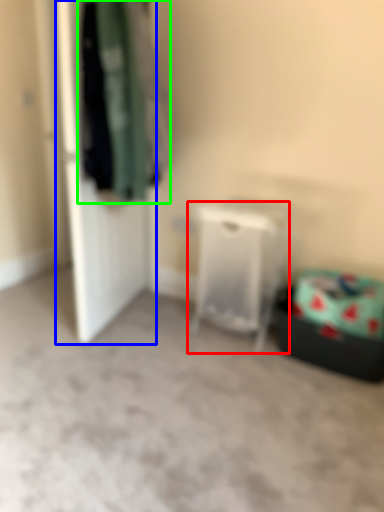
Question: Based on their relative distances, which object is farther from furniture (highlighted by a red box)? Choose from door (highlighted by a blue box) and clothing (highlighted by a green box).

Choices:
 (A) door
 (B) clothing

Answer: (A)